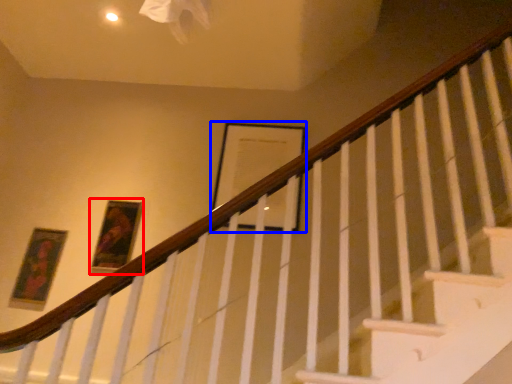
Question: Which object is further to the camera taking this photo, picture frame (highlighted by a red box) or picture frame (highlighted by a blue box)?

Choices:
 (A) picture frame
 (B) picture frame

Answer: (B)